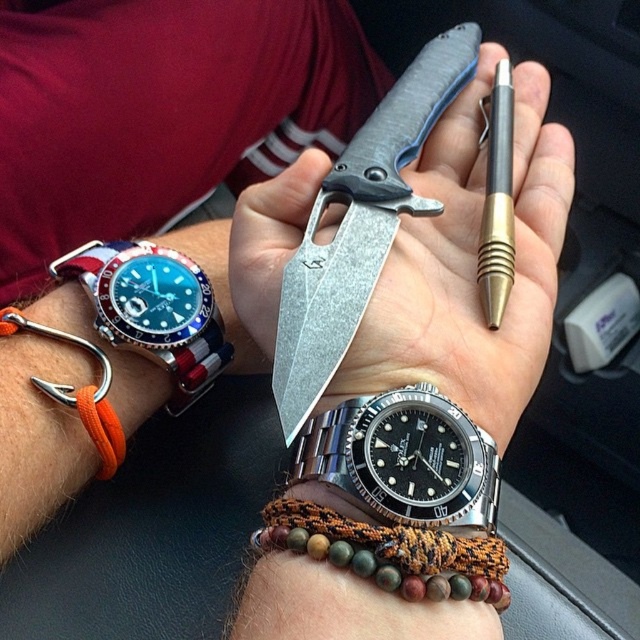
Question: Observing the image, what is the correct spatial positioning of blue dial steel watch at left in reference to orange cord at left?

Choices:
 (A) left
 (B) right

Answer: (B)

Question: Is black stainless steel watch at center above matte black pen at center?

Choices:
 (A) no
 (B) yes

Answer: (A)

Question: Which point is closer to the camera taking this photo?

Choices:
 (A) (493, 106)
 (B) (97, 451)
 (C) (550, 275)

Answer: (B)

Question: Is metallic gray knife at center above blue dial steel watch at left?

Choices:
 (A) yes
 (B) no

Answer: (A)

Question: Which object appears farthest from the camera in this image?

Choices:
 (A) orange cord at left
 (B) blue dial steel watch at left

Answer: (B)

Question: Which object is closer to the camera taking this photo?

Choices:
 (A) black stainless steel watch at center
 (B) metallic gray knife at center

Answer: (A)